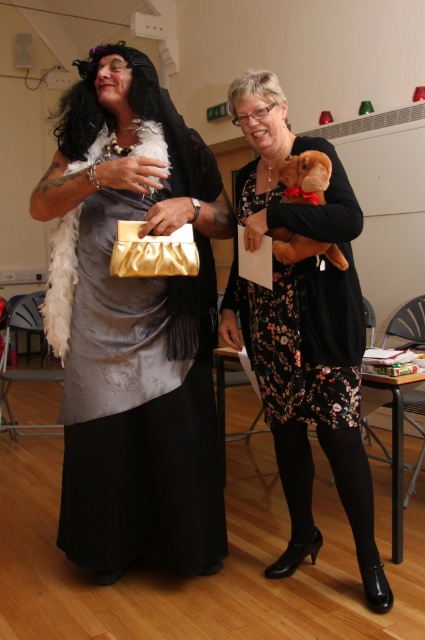
Question: Is floral fabric dress at center closer to the viewer compared to brown plush toy at center?

Choices:
 (A) yes
 (B) no

Answer: (A)

Question: Is floral dress at center to the right of brown plush toy at center from the viewer's perspective?

Choices:
 (A) yes
 (B) no

Answer: (B)

Question: Based on their relative distances, which object is farther from the satin gold clutch at center?

Choices:
 (A) brown plush toy at center
 (B) floral dress at center

Answer: (A)

Question: Which of the following is the closest to the observer?

Choices:
 (A) satin gold clutch at center
 (B) floral fabric dress at center
 (C) brown plush toy at center

Answer: (A)

Question: Which of the following is the closest to the observer?

Choices:
 (A) floral fabric dress at center
 (B) floral dress at center

Answer: (A)

Question: Does satin gold clutch at center appear over floral dress at center?

Choices:
 (A) no
 (B) yes

Answer: (B)